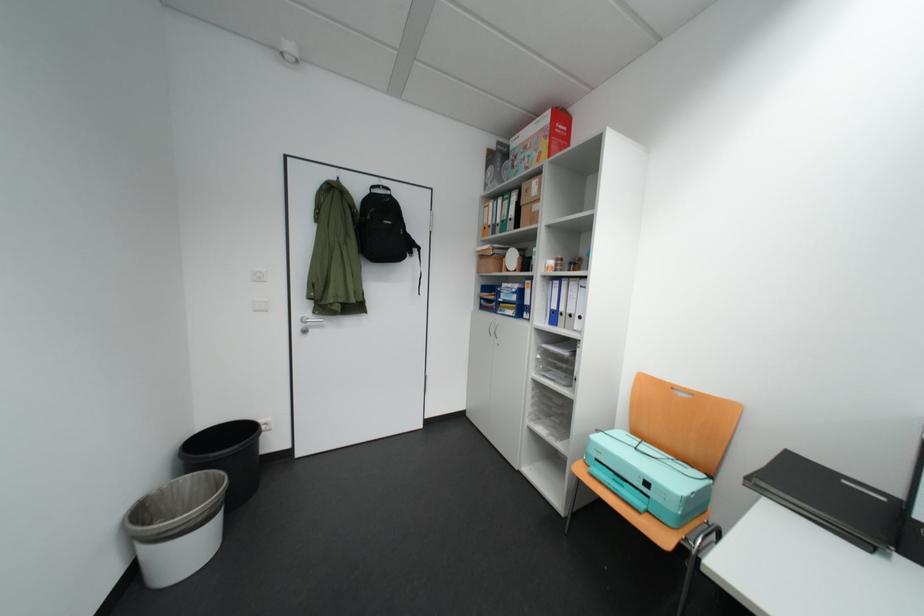
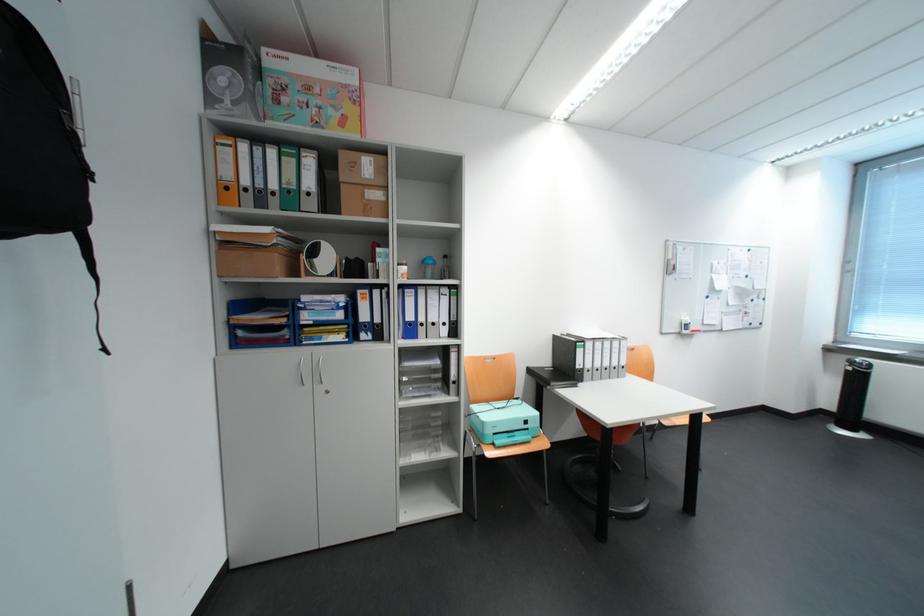
Find the pixel in the second image that matches pixel 509 222 in the first image.

(285, 188)